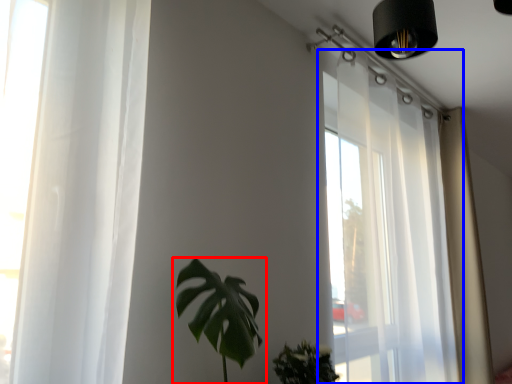
Question: Which object is closer to the camera taking this photo, houseplant (highlighted by a red box) or window (highlighted by a blue box)?

Choices:
 (A) houseplant
 (B) window

Answer: (A)